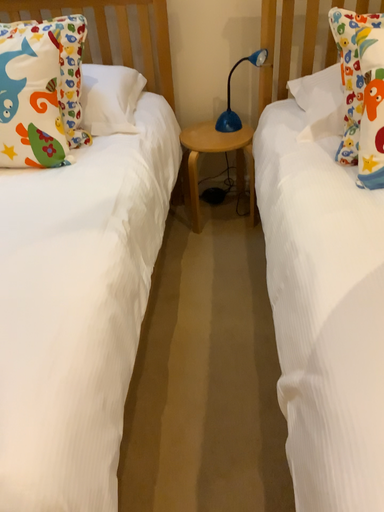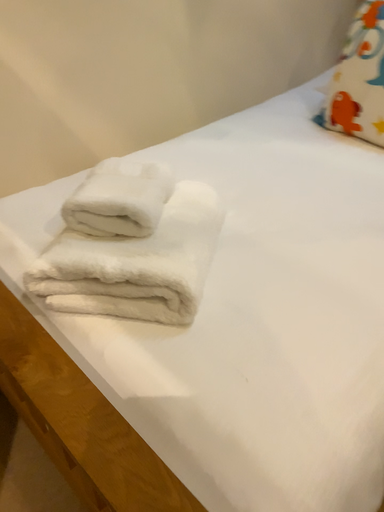
Question: How did the camera likely rotate when shooting the video?

Choices:
 (A) rotated right
 (B) rotated left

Answer: (B)